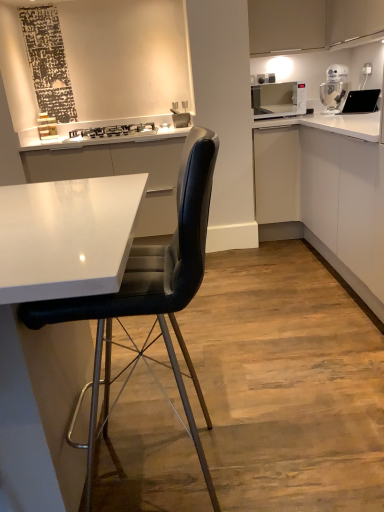
Question: Is white glossy microwave at upper right oriented towards white matte cabinet at center-right, which appears as the 2th cabinetry when viewed from the top?

Choices:
 (A) no
 (B) yes

Answer: (A)

Question: Is white glossy microwave at upper right with white matte cabinet at center-right, the second cabinetry when ordered from bottom to top?

Choices:
 (A) yes
 (B) no

Answer: (B)

Question: Does white glossy microwave at upper right have a lesser width compared to white matte cabinet at center-right, the second cabinetry when ordered from bottom to top?

Choices:
 (A) yes
 (B) no

Answer: (A)

Question: Considering the relative sizes of white glossy microwave at upper right and white matte cabinet at center-right, the second cabinetry when ordered from bottom to top, in the image provided, is white glossy microwave at upper right bigger than white matte cabinet at center-right, the second cabinetry when ordered from bottom to top,?

Choices:
 (A) yes
 (B) no

Answer: (B)

Question: Is white glossy microwave at upper right to the left of white matte cabinet at center-right, which appears as the 2th cabinetry when viewed from the top, from the viewer's perspective?

Choices:
 (A) no
 (B) yes

Answer: (A)

Question: Is point (256, 52) positioned closer to the camera than point (273, 172)?

Choices:
 (A) farther
 (B) closer

Answer: (A)

Question: In terms of size, does matte white cabinet at upper right, which is the first cabinetry in top-to-bottom order, appear bigger or smaller than white glossy cabinet at right, the 1th cabinetry positioned from the bottom?

Choices:
 (A) small
 (B) big

Answer: (A)

Question: Would you say matte white cabinet at upper right, the third cabinetry when ordered from bottom to top, is to the left or to the right of white glossy cabinet at right, marked as the third cabinetry in a top-to-bottom arrangement, in the picture?

Choices:
 (A) left
 (B) right

Answer: (A)

Question: Do you think matte white cabinet at upper right, the third cabinetry when ordered from bottom to top, is within white glossy cabinet at right, marked as the third cabinetry in a top-to-bottom arrangement, or outside of it?

Choices:
 (A) inside
 (B) outside

Answer: (B)

Question: Is white glossy cabinet at right, marked as the third cabinetry in a top-to-bottom arrangement, wider or thinner than black leather chair at center?

Choices:
 (A) wide
 (B) thin

Answer: (A)

Question: Is white glossy cabinet at right, the 1th cabinetry positioned from the bottom, in front of or behind black leather chair at center in the image?

Choices:
 (A) front
 (B) behind

Answer: (B)

Question: Is point click(x=380, y=221) closer or farther from the camera than point click(x=200, y=153)?

Choices:
 (A) farther
 (B) closer

Answer: (A)

Question: Considering the relative positions of white glossy cabinet at right, the 1th cabinetry positioned from the bottom, and black leather chair at center in the image provided, is white glossy cabinet at right, the 1th cabinetry positioned from the bottom, to the left or to the right of black leather chair at center?

Choices:
 (A) right
 (B) left

Answer: (A)

Question: Is black glass stove at upper center bigger or smaller than black glossy sink at upper right?

Choices:
 (A) small
 (B) big

Answer: (B)

Question: Considering the positions of point (114, 125) and point (367, 103), is point (114, 125) closer or farther from the camera than point (367, 103)?

Choices:
 (A) closer
 (B) farther

Answer: (B)